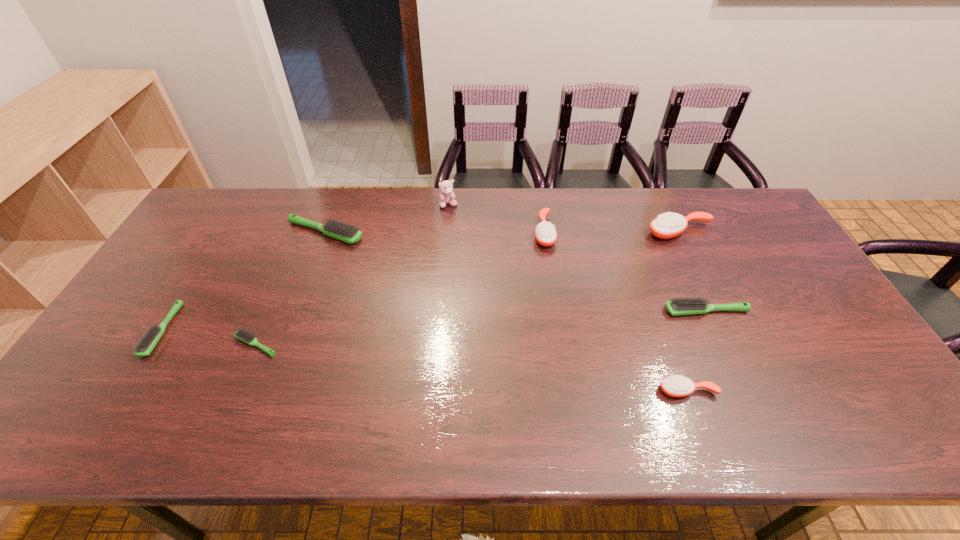
What are the coordinates of `vacant space located on the back of the seventh tallest object` in the screenshot? It's located at (202, 267).

The height and width of the screenshot is (540, 960). I want to click on free location located 0.320m on the left of the shortest object, so click(x=108, y=345).

Find the location of a particular element. The width and height of the screenshot is (960, 540). teddy bear that is at the far edge is located at coordinates (447, 196).

You are a GUI agent. You are given a task and a screenshot of the screen. Output one action in this format:
    pyautogui.click(x=<x>, y=<y>)
    Task: Click on the object positioned at the left edge
    The width and height of the screenshot is (960, 540).
    Given the screenshot: What is the action you would take?
    pyautogui.click(x=144, y=347)

I want to click on free space at the far edge, so click(274, 197).

Identify the location of vacant region at the left edge of the desktop. (132, 382).

Image resolution: width=960 pixels, height=540 pixels. In order to click on vacant space at the far right corner in this screenshot , I will do click(743, 227).

Where is `free spot between the rightmost light hairbrush and the fourth object from left to right`? free spot between the rightmost light hairbrush and the fourth object from left to right is located at coordinates (577, 258).

Identify the location of blank region between the third smallest light hairbrush and the farthest light hairbrush. The image size is (960, 540). (516, 272).

Locate an element on the screen. The height and width of the screenshot is (540, 960). free area in between the rightmost light hairbrush and the farthest light hairbrush is located at coordinates (516, 272).